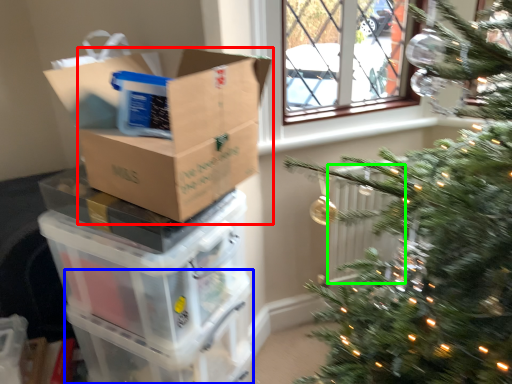
Question: Estimate the real-world distances between objects in this image. Which object is farther from cardboard box (highlighted by a red box), glass box (highlighted by a blue box) or radiator (highlighted by a green box)?

Choices:
 (A) glass box
 (B) radiator

Answer: (B)